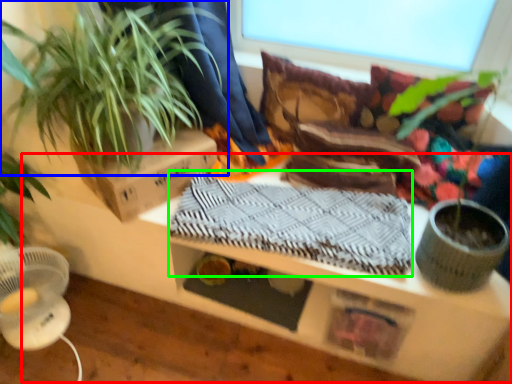
Question: Estimate the real-world distances between objects in this image. Which object is farther from table (highlighted by a red box), houseplant (highlighted by a blue box) or blanket (highlighted by a green box)?

Choices:
 (A) houseplant
 (B) blanket

Answer: (A)